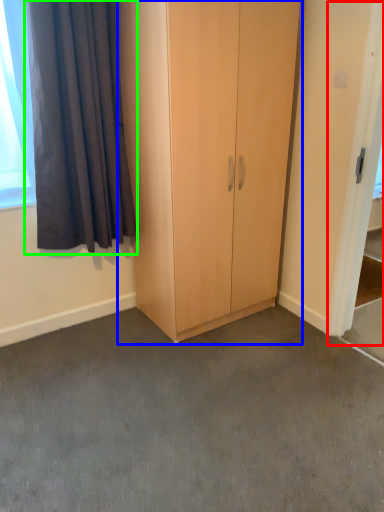
Question: Which object is positioned closest to screen door (highlighted by a red box)? Select from cupboard (highlighted by a blue box) and curtain (highlighted by a green box).

Choices:
 (A) cupboard
 (B) curtain

Answer: (A)